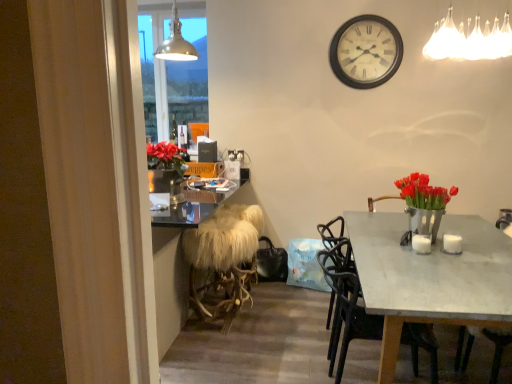
The width and height of the screenshot is (512, 384). What do you see at coordinates (345, 303) in the screenshot? I see `matte black chair at center` at bounding box center [345, 303].

Measure the distance between point (450,234) and camera.

Point (450,234) is 8.08 feet away from camera.

Locate an element on the screen. This screenshot has height=384, width=512. metallic pendant light at upper center, the 2th lamp from the right is located at coordinates (176, 43).

I want to click on white glossy coffee cup at right, the 1th coffee cup in the left-to-right sequence, so click(x=421, y=243).

Is point (345, 333) closer or farther from the camera than point (461, 247)?

Point (345, 333) is closer to the camera than point (461, 247).

Is matte black chair at center in contact with white glossy coffee cup at table right, the second coffee cup positioned from the left?

There is a gap between matte black chair at center and white glossy coffee cup at table right, the second coffee cup positioned from the left.

Considering the sizes of matte black chair at center and white glossy coffee cup at table right, which is the 1th coffee cup in right-to-left order, in the image, is matte black chair at center taller or shorter than white glossy coffee cup at table right, which is the 1th coffee cup in right-to-left order,?

In the image, matte black chair at center appears to be taller than white glossy coffee cup at table right, which is the 1th coffee cup in right-to-left order.

Is matte black chair at center wider or thinner than white glossy coffee cup at table right, the second coffee cup positioned from the left?

Considering their sizes, matte black chair at center looks broader than white glossy coffee cup at table right, the second coffee cup positioned from the left.

I want to click on desk that appears below the white fabric chandelier at upper right, which appears as the second lamp when viewed from the back (from a real-world perspective), so click(430, 277).

Consider the image. Considering the relative positions of white fabric chandelier at upper right, acting as the first lamp starting from the right, and matte gray table at center in the image provided, is white fabric chandelier at upper right, acting as the first lamp starting from the right, behind matte gray table at center?

That is True.

Can we say white fabric chandelier at upper right, acting as the first lamp starting from the right, lies outside matte gray table at center?

white fabric chandelier at upper right, acting as the first lamp starting from the right, lies outside matte gray table at center's area.

From the image's perspective, would you say white fabric chandelier at upper right, which is counted as the 1th lamp, starting from the front, is shown under matte gray table at center?

No, from the image's perspective, white fabric chandelier at upper right, which is counted as the 1th lamp, starting from the front, is not below matte gray table at center.

Which is in front, metallic silver vase with red tulips at right or metallic glass window at upper left?

metallic silver vase with red tulips at right is more forward.

Is metallic silver vase with red tulips at right facing towards metallic glass window at upper left?

No, metallic silver vase with red tulips at right does not turn towards metallic glass window at upper left.

Which object is positioned more to the left, metallic silver vase with red tulips at right or metallic glass window at upper left?

metallic glass window at upper left.

Consider the image. Is metallic silver vase with red tulips at right taller than metallic glass window at upper left?

No, metallic silver vase with red tulips at right is not taller than metallic glass window at upper left.

Can you confirm if matte gray table at center is bigger than matte black chair at center?

Correct, matte gray table at center is larger in size than matte black chair at center.

Does point (405, 318) come behind point (353, 318)?

No, it is not.

From a real-world perspective, between matte gray table at center and matte black chair at center, who is vertically lower?

matte gray table at center.

Considering the relative sizes of white glossy coffee cup at table right, which is the 1th coffee cup in right-to-left order, and metallic pendant light at upper center, acting as the 1th lamp starting from the left, in the image provided, is white glossy coffee cup at table right, which is the 1th coffee cup in right-to-left order, taller than metallic pendant light at upper center, acting as the 1th lamp starting from the left,?

Incorrect, the height of white glossy coffee cup at table right, which is the 1th coffee cup in right-to-left order, is not larger of that of metallic pendant light at upper center, acting as the 1th lamp starting from the left.

From a real-world perspective, is white glossy coffee cup at table right, the second coffee cup positioned from the left, on metallic pendant light at upper center, the second lamp in the front-to-back sequence?

No.

Is white glossy coffee cup at table right, which is the 1th coffee cup in right-to-left order, positioned behind metallic pendant light at upper center, the 2th lamp from the right?

No, white glossy coffee cup at table right, which is the 1th coffee cup in right-to-left order, is closer to the camera.

How much distance is there between white glossy coffee cup at table right, the second coffee cup positioned from the left, and metallic pendant light at upper center, acting as the 1th lamp starting from the left?

white glossy coffee cup at table right, the second coffee cup positioned from the left, and metallic pendant light at upper center, acting as the 1th lamp starting from the left, are 6.94 feet apart.

Consider the image. Is white wooden clock at upper center bigger than black leather speaker at upper center?

Yes.

From the image's perspective, which one is positioned higher, white wooden clock at upper center or black leather speaker at upper center?

white wooden clock at upper center.

Is white wooden clock at upper center not close to black leather speaker at upper center?

Absolutely, white wooden clock at upper center is distant from black leather speaker at upper center.

Is white wooden clock at upper center looking in the opposite direction of black leather speaker at upper center?

No, black leather speaker at upper center is not at the back of white wooden clock at upper center.

Which of these two, metallic pendant light at upper center, the 2th lamp from the right, or metallic silver vase with red tulips at right, stands shorter?

metallic silver vase with red tulips at right.

From a real-world perspective, which is physically below, metallic pendant light at upper center, the second lamp in the front-to-back sequence, or metallic silver vase with red tulips at right?

metallic silver vase with red tulips at right is physically lower.

In terms of width, does metallic pendant light at upper center, the first lamp viewed from the back, look wider or thinner when compared to metallic silver vase with red tulips at right?

In the image, metallic pendant light at upper center, the first lamp viewed from the back, appears to be wider than metallic silver vase with red tulips at right.

Consider the image. How far apart are metallic pendant light at upper center, the second lamp in the front-to-back sequence, and metallic silver vase with red tulips at right?

metallic pendant light at upper center, the second lamp in the front-to-back sequence, is 1.79 meters from metallic silver vase with red tulips at right.

The width and height of the screenshot is (512, 384). I want to click on chair on the left of white glossy coffee cup at table right, which is the 1th coffee cup in right-to-left order, so click(x=345, y=303).

Locate an element on the screen. The height and width of the screenshot is (384, 512). the 1st lamp behind the matte gray table at center, counting from the anchor's position is located at coordinates (469, 40).

Which object lies nearer to the anchor point matte gray table at center, white glossy coffee cup at table right, the second coffee cup positioned from the left, or metallic silver vase with red tulips at right?

metallic silver vase with red tulips at right lies closer to matte gray table at center than the other object.

Estimate the real-world distances between objects in this image. Which object is further from metallic pendant light at upper center, the 2th lamp from the right, metallic silver vase with red tulips at right or metallic glass window at upper left?

metallic silver vase with red tulips at right is further to metallic pendant light at upper center, the 2th lamp from the right.

Estimate the real-world distances between objects in this image. Which object is further from metallic silver vase with red tulips at right, white glossy coffee cup at table right, the second coffee cup positioned from the left, or white wooden clock at upper center?

Among the two, white wooden clock at upper center is located further to metallic silver vase with red tulips at right.

Based on their spatial positions, is black leather speaker at upper center or matte black chair at center closer to metallic silver vase with red tulips at right?

Based on the image, matte black chair at center appears to be nearer to metallic silver vase with red tulips at right.

Looking at this image, based on their spatial positions, is black leather speaker at upper center or white fabric chandelier at upper right, acting as the first lamp starting from the right, further from metallic silver vase with red tulips at right?

black leather speaker at upper center lies further to metallic silver vase with red tulips at right than the other object.

From the image, which object appears to be farther from white glossy coffee cup at table right, which is the 1th coffee cup in right-to-left order, metallic silver vase with red tulips at right or black leather speaker at upper center?

Based on the image, black leather speaker at upper center appears to be further to white glossy coffee cup at table right, which is the 1th coffee cup in right-to-left order.

From the image, which object appears to be nearer to matte black chair at center, white furry stool at center or metallic pendant light at upper center, the 2th lamp from the right?

white furry stool at center is positioned closer to the anchor matte black chair at center.

Which object lies further to the anchor point black leather speaker at upper center, white glossy coffee cup at table right, the second coffee cup positioned from the left, or white wooden clock at upper center?

Among the two, white glossy coffee cup at table right, the second coffee cup positioned from the left, is located further to black leather speaker at upper center.

The width and height of the screenshot is (512, 384). Identify the location of lamp situated between metallic glass window at upper left and white glossy coffee cup at right, the 1th coffee cup in the left-to-right sequence, from left to right. (176, 43).

Where is `stool between white wooden clock at upper center and matte black chair at center from top to bottom`? The image size is (512, 384). stool between white wooden clock at upper center and matte black chair at center from top to bottom is located at coordinates (223, 261).

Find the location of a particular element. The height and width of the screenshot is (384, 512). stool between metallic glass window at upper left and metallic silver vase with red tulips at right from left to right is located at coordinates (223, 261).

Locate an element on the screen. floral arrangement situated between white furry stool at center and white fabric chandelier at upper right, the 2th lamp viewed from the left, from left to right is located at coordinates (x=423, y=205).